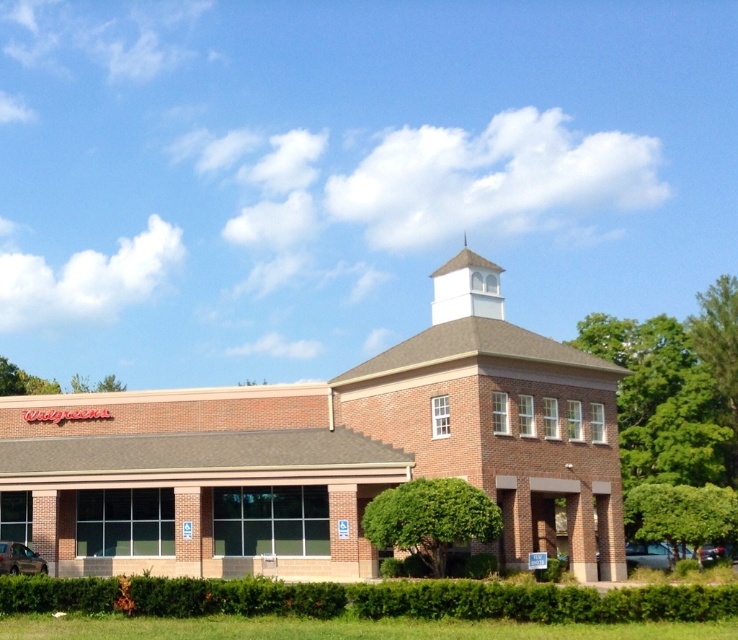
Can you confirm if green leafy tree at center is shorter than green leafy tree at lower right?

Yes, green leafy tree at center is shorter than green leafy tree at lower right.

Does green leafy tree at center have a lesser width compared to green leafy tree at lower right?

Indeed, green leafy tree at center has a lesser width compared to green leafy tree at lower right.

You are a GUI agent. You are given a task and a screenshot of the screen. Output one action in this format:
    pyautogui.click(x=<x>, y=<y>)
    Task: Click on the green leafy tree at center
    The width and height of the screenshot is (738, 640).
    Given the screenshot: What is the action you would take?
    430,518

In the scene shown: Does green leafy tree at right have a greater height compared to green leafy tree at lower right?

Yes, green leafy tree at right is taller than green leafy tree at lower right.

Describe the element at coordinates (675, 388) in the screenshot. I see `green leafy tree at right` at that location.

The image size is (738, 640). I want to click on green leafy tree at right, so click(x=675, y=388).

Identify the location of green leafy tree at right. (675, 388).

Can you confirm if green leafy tree at right is positioned above green leafy tree at lower left?

Indeed, green leafy tree at right is positioned over green leafy tree at lower left.

Does point (689, 445) come farther from viewer compared to point (72, 385)?

That is False.

Where is `green leafy tree at right`? Image resolution: width=738 pixels, height=640 pixels. green leafy tree at right is located at coordinates (675, 388).